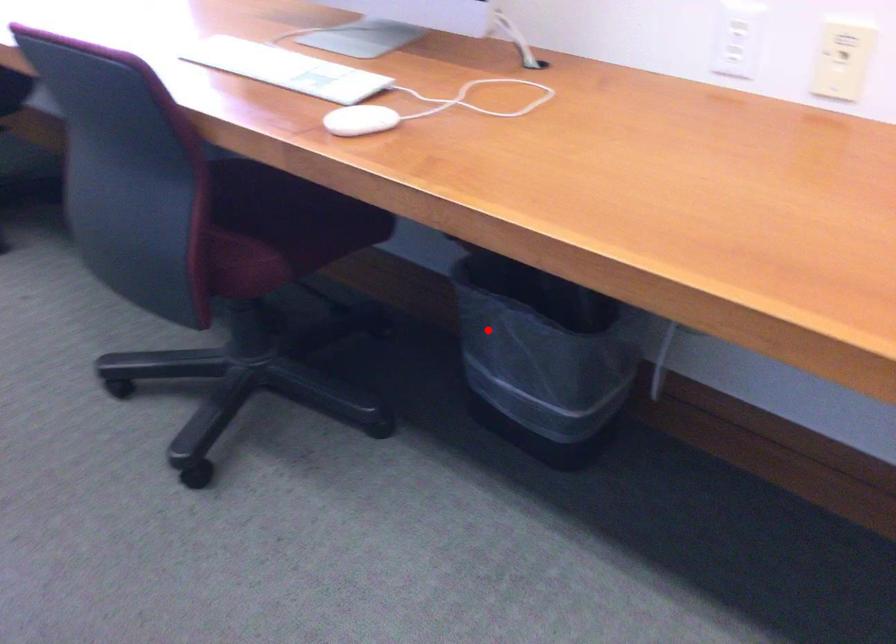
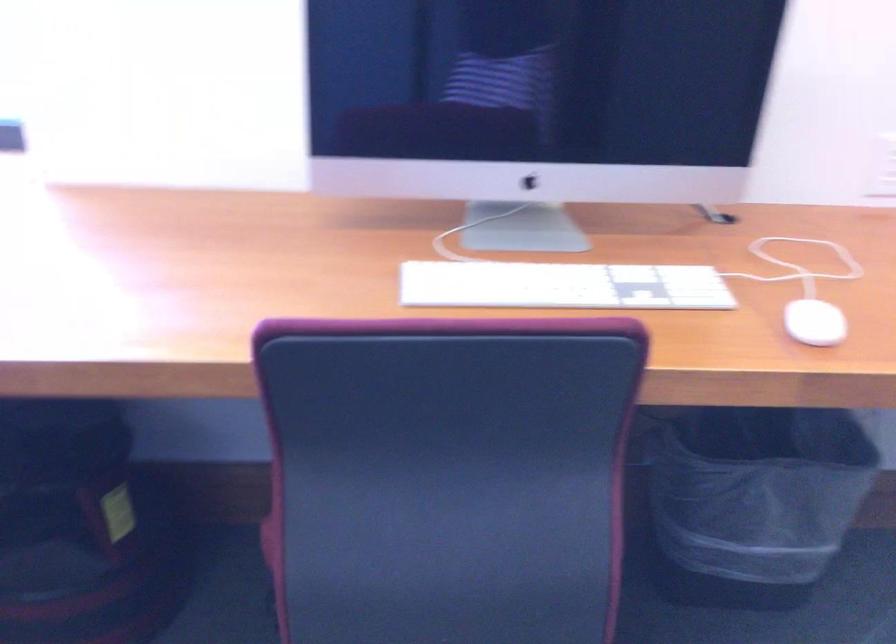
In the second image, find the point that corresponds to the highlighted location in the first image.

(753, 500)